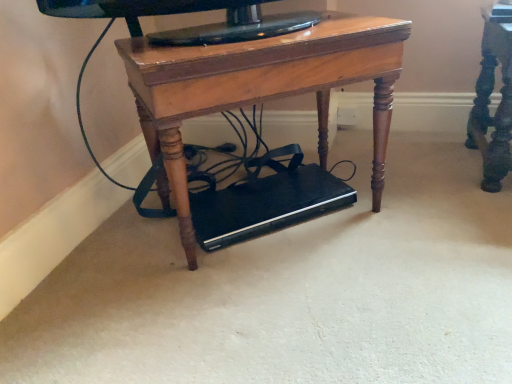
Identify the location of blank space situated above wooden table at center (from a real-world perspective). Image resolution: width=512 pixels, height=384 pixels. (267, 30).